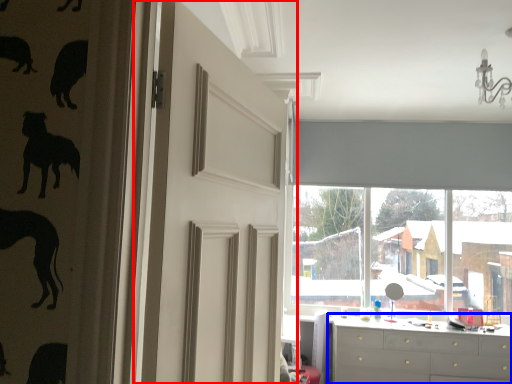
Question: Among these objects, which one is nearest to the camera, door (highlighted by a red box) or chest of drawers (highlighted by a blue box)?

Choices:
 (A) door
 (B) chest of drawers

Answer: (A)